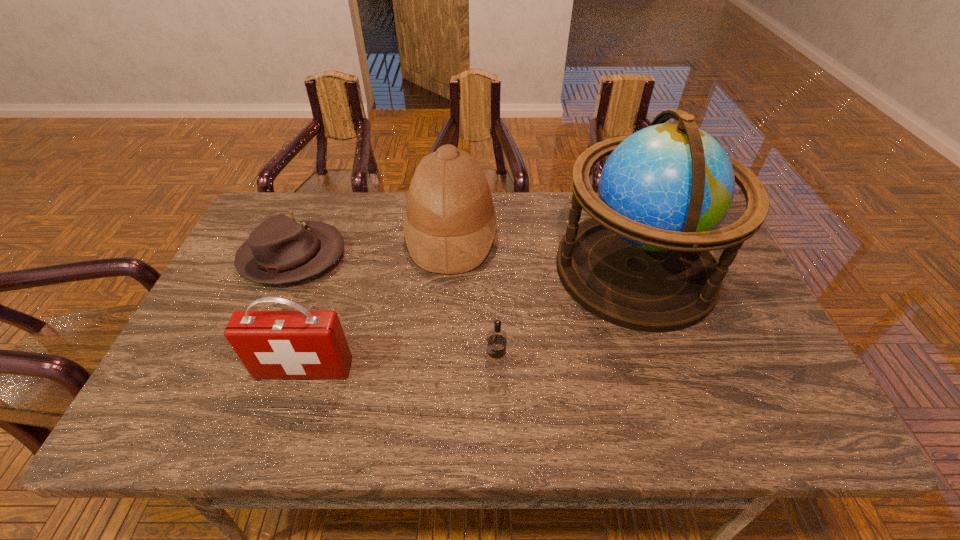
This screenshot has height=540, width=960. Identify the location of free region located on the label of the fourth tallest object. (391, 366).

Locate an element on the screen. blank space located on the label of the fourth tallest object is located at coordinates (429, 366).

Where is `vacant space positioned 0.340m on the label of the fourth tallest object`? vacant space positioned 0.340m on the label of the fourth tallest object is located at coordinates (340, 366).

The width and height of the screenshot is (960, 540). What are the coordinates of `blank space located 0.220m on the decorative side of the shortest object` in the screenshot? It's located at (421, 258).

The image size is (960, 540). I want to click on globe that is positioned at the far edge, so click(x=642, y=261).

Find the location of a particular element. The width and height of the screenshot is (960, 540). object at the left edge is located at coordinates (280, 250).

Where is `object that is at the right edge`? The width and height of the screenshot is (960, 540). object that is at the right edge is located at coordinates (642, 261).

Locate an element on the screen. This screenshot has height=540, width=960. object that is at the far left corner is located at coordinates (280, 250).

You are a GUI agent. You are given a task and a screenshot of the screen. Output one action in this format:
    pyautogui.click(x=<x>, y=<y>)
    Task: Click on the object present at the far right corner
    
    Given the screenshot: What is the action you would take?
    pyautogui.click(x=642, y=261)

This screenshot has height=540, width=960. In the image, there is a desktop. What are the coordinates of `free space at the far edge` in the screenshot? It's located at (333, 210).